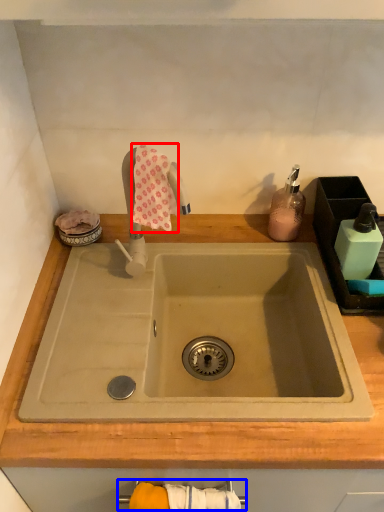
Question: Which of the following is the closest to the observer, bath towel (highlighted by a red box) or towel bar (highlighted by a blue box)?

Choices:
 (A) bath towel
 (B) towel bar

Answer: (B)